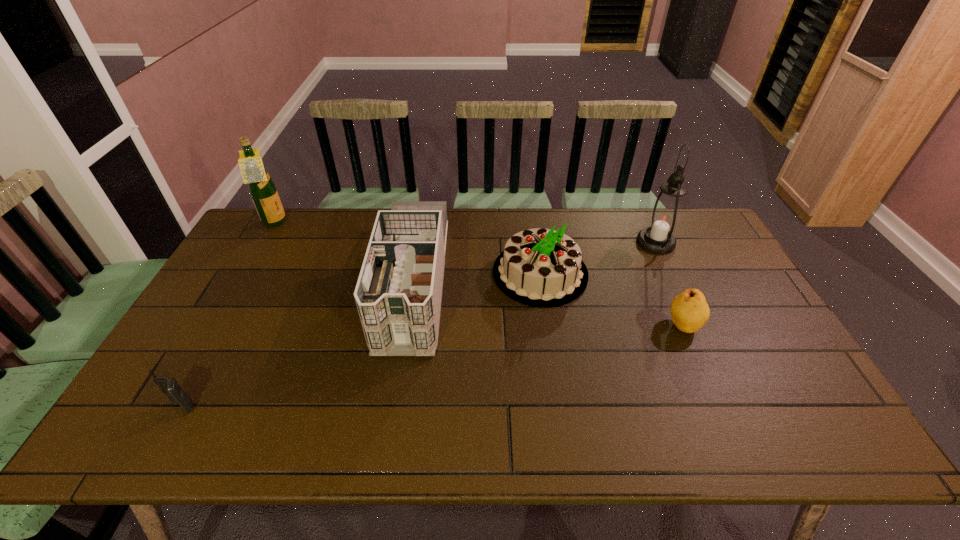
Locate an element on the screen. blank space located 0.290m on the left of the pear is located at coordinates (562, 325).

Where is `oil lamp at the far edge`? This screenshot has height=540, width=960. oil lamp at the far edge is located at coordinates (664, 217).

Image resolution: width=960 pixels, height=540 pixels. I want to click on liquor situated at the far edge, so click(262, 189).

Locate an element on the screen. This screenshot has width=960, height=540. dollhouse that is positioned at the far edge is located at coordinates (398, 294).

Locate an element on the screen. The image size is (960, 540). birthday cake situated at the far edge is located at coordinates (539, 267).

I want to click on object that is positioned at the near edge, so click(x=169, y=386).

Identify the location of liquor at the left edge. This screenshot has height=540, width=960. (262, 189).

Identify the location of cellular telephone situated at the left edge. (169, 386).

This screenshot has width=960, height=540. Find the location of `object positioned at the right edge`. object positioned at the right edge is located at coordinates (664, 217).

Where is `object present at the far left corner`? Image resolution: width=960 pixels, height=540 pixels. object present at the far left corner is located at coordinates (262, 189).